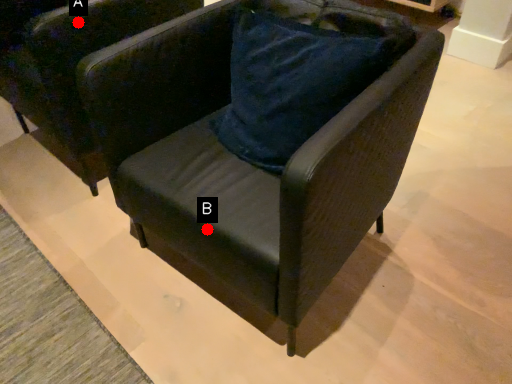
Question: Two points are circled on the image, labeled by A and B beside each circle. Which point is closer to the camera taking this photo?

Choices:
 (A) A is closer
 (B) B is closer

Answer: (B)